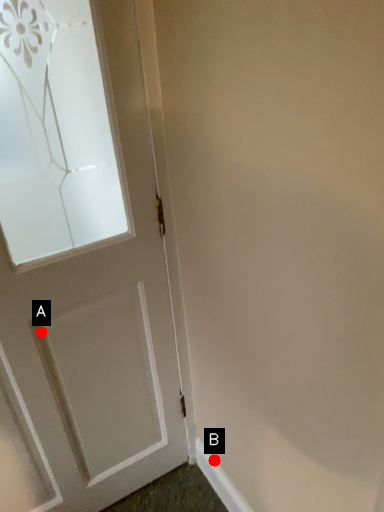
Question: Two points are circled on the image, labeled by A and B beside each circle. Which point is closer to the camera taking this photo?

Choices:
 (A) A is closer
 (B) B is closer

Answer: (A)